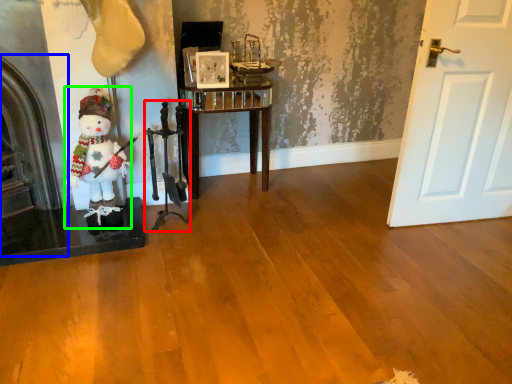
Question: Considering the real-world distances, which object is closest to chair (highlighted by a red box)? fireplace (highlighted by a blue box) or figurine (highlighted by a green box).

Choices:
 (A) fireplace
 (B) figurine

Answer: (B)